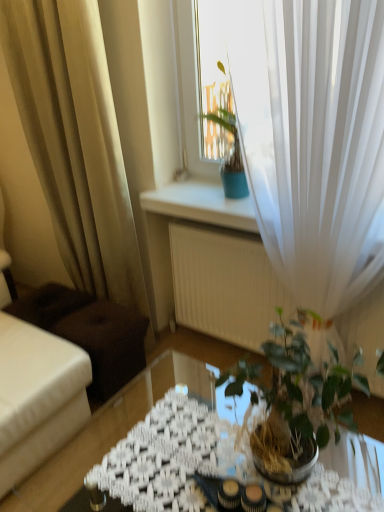
Locate an element on the screen. translucent glass table at center is located at coordinates (131, 444).

This screenshot has width=384, height=512. What do you see at coordinates (317, 156) in the screenshot? I see `white sheer curtain at upper right, the 1th curtain positioned from the right` at bounding box center [317, 156].

Describe the element at coordinates (75, 141) in the screenshot. I see `beige sheer curtain at left, arranged as the first curtain when viewed from the left` at that location.

Find the location of a particular element. Image resolution: width=384 pixels, height=512 pixels. translucent glass table at center is located at coordinates pos(131,444).

Considering the relative sizes of beige sheer curtain at left, arranged as the first curtain when viewed from the left, and green glossy houseplant at center in the image provided, is beige sheer curtain at left, arranged as the first curtain when viewed from the left, shorter than green glossy houseplant at center?

Incorrect, the height of beige sheer curtain at left, arranged as the first curtain when viewed from the left, does not fall short of that of green glossy houseplant at center.

Would you say beige sheer curtain at left, arranged as the first curtain when viewed from the left, is inside or outside green glossy houseplant at center?

beige sheer curtain at left, arranged as the first curtain when viewed from the left, is spatially situated outside green glossy houseplant at center.

Which of these two, beige sheer curtain at left, arranged as the first curtain when viewed from the left, or green glossy houseplant at center, is thinner?

beige sheer curtain at left, arranged as the first curtain when viewed from the left.

Could you tell me if beige sheer curtain at left, arranged as the first curtain when viewed from the left, is turned towards green glossy houseplant at center?

No, beige sheer curtain at left, arranged as the first curtain when viewed from the left, is not aimed at green glossy houseplant at center.

Does white sheer curtain at upper right, which is the 2th curtain from left to right, have a lesser width compared to green glossy houseplant at center?

Indeed, white sheer curtain at upper right, which is the 2th curtain from left to right, has a lesser width compared to green glossy houseplant at center.

Can you tell me how much white sheer curtain at upper right, which is the 2th curtain from left to right, and green glossy houseplant at center differ in facing direction?

white sheer curtain at upper right, which is the 2th curtain from left to right, and green glossy houseplant at center are facing 2.37 degrees away from each other.

Does white sheer curtain at upper right, which is the 2th curtain from left to right, have a larger size compared to green glossy houseplant at center?

Indeed, white sheer curtain at upper right, which is the 2th curtain from left to right, has a larger size compared to green glossy houseplant at center.

Find the location of a particular element. Image resolution: width=384 pixels, height=512 pixels. houseplant on the left of white sheer curtain at upper right, which is the 2th curtain from left to right is located at coordinates (308, 387).

From a real-world perspective, which object stands above the other?

In real-world perspective, beige sheer curtain at left, which is counted as the second curtain, starting from the right, is above.

How different are the orientations of beige sheer curtain at left, which is counted as the second curtain, starting from the right, and translucent glass table at center in degrees?

6.02 degrees separate the facing orientations of beige sheer curtain at left, which is counted as the second curtain, starting from the right, and translucent glass table at center.

Which of these two, beige sheer curtain at left, which is counted as the second curtain, starting from the right, or translucent glass table at center, is thinner?

With smaller width is beige sheer curtain at left, which is counted as the second curtain, starting from the right.

Which point is more forward, (315, 385) or (342, 451)?

The point (315, 385) is closer.

From a real-world perspective, is green glossy houseplant at center positioned above or below translucent glass table at center?

green glossy houseplant at center is situated higher than translucent glass table at center in the real world.

Between white sheer curtain at upper right, the 1th curtain positioned from the right, and translucent glass table at center, which one has more height?

white sheer curtain at upper right, the 1th curtain positioned from the right, is taller.

Is white sheer curtain at upper right, the 1th curtain positioned from the right, next to translucent glass table at center and touching it?

white sheer curtain at upper right, the 1th curtain positioned from the right, and translucent glass table at center are not in contact.

Which is farther from the camera, (261, 81) or (366, 459)?

The point (366, 459) is farther.

From the image's perspective, is white sheer curtain at upper right, the 1th curtain positioned from the right, on translucent glass table at center?

Yes, from the image's perspective, white sheer curtain at upper right, the 1th curtain positioned from the right, is over translucent glass table at center.

Where is `curtain that is in front of the beige sheer curtain at left, arranged as the first curtain when viewed from the left`? curtain that is in front of the beige sheer curtain at left, arranged as the first curtain when viewed from the left is located at coordinates (317, 156).

Considering the sizes of white sheer curtain at upper right, which is the 2th curtain from left to right, and beige sheer curtain at left, arranged as the first curtain when viewed from the left, in the image, is white sheer curtain at upper right, which is the 2th curtain from left to right, taller or shorter than beige sheer curtain at left, arranged as the first curtain when viewed from the left,?

white sheer curtain at upper right, which is the 2th curtain from left to right, is shorter than beige sheer curtain at left, arranged as the first curtain when viewed from the left.

Considering the sizes of white sheer curtain at upper right, the 1th curtain positioned from the right, and beige sheer curtain at left, which is counted as the second curtain, starting from the right, in the image, is white sheer curtain at upper right, the 1th curtain positioned from the right, wider or thinner than beige sheer curtain at left, which is counted as the second curtain, starting from the right,?

Considering their sizes, white sheer curtain at upper right, the 1th curtain positioned from the right, looks broader than beige sheer curtain at left, which is counted as the second curtain, starting from the right.

Does white sheer curtain at upper right, the 1th curtain positioned from the right, appear on the right side of beige sheer curtain at left, which is counted as the second curtain, starting from the right?

Yes, white sheer curtain at upper right, the 1th curtain positioned from the right, is to the right of beige sheer curtain at left, which is counted as the second curtain, starting from the right.

Looking at their sizes, would you say translucent glass table at center is wider or thinner than beige sheer curtain at left, arranged as the first curtain when viewed from the left?

Considering their sizes, translucent glass table at center looks broader than beige sheer curtain at left, arranged as the first curtain when viewed from the left.

Are translucent glass table at center and beige sheer curtain at left, which is counted as the second curtain, starting from the right, far apart?

No, translucent glass table at center is not far from beige sheer curtain at left, which is counted as the second curtain, starting from the right.

Based on the photo, in terms of height, does translucent glass table at center look taller or shorter compared to beige sheer curtain at left, arranged as the first curtain when viewed from the left?

Clearly, translucent glass table at center is shorter compared to beige sheer curtain at left, arranged as the first curtain when viewed from the left.

From the image's perspective, is translucent glass table at center under beige sheer curtain at left, which is counted as the second curtain, starting from the right?

Correct, translucent glass table at center appears lower than beige sheer curtain at left, which is counted as the second curtain, starting from the right, in the image.

From a real-world perspective, which curtain is the 1st one above the green glossy houseplant at center? Please provide its 2D coordinates.

[(75, 141)]

At what (x,y) coordinates should I click in order to perform the action: click on houseplant in front of the white sheer curtain at upper right, the 1th curtain positioned from the right. Please return your answer as a coordinate pair (x, y). Looking at the image, I should click on (308, 387).

Based on their spatial positions, is beige sheer curtain at left, which is counted as the second curtain, starting from the right, or translucent glass table at center further from green glossy houseplant at center?

beige sheer curtain at left, which is counted as the second curtain, starting from the right, lies further to green glossy houseplant at center than the other object.

Estimate the real-world distances between objects in this image. Which object is closer to beige sheer curtain at left, arranged as the first curtain when viewed from the left, green glossy houseplant at center or white sheer curtain at upper right, which is the 2th curtain from left to right?

white sheer curtain at upper right, which is the 2th curtain from left to right, is positioned closer to the anchor beige sheer curtain at left, arranged as the first curtain when viewed from the left.

When comparing their distances from beige sheer curtain at left, which is counted as the second curtain, starting from the right, does white sheer curtain at upper right, which is the 2th curtain from left to right, or translucent glass table at center seem closer?

white sheer curtain at upper right, which is the 2th curtain from left to right, is closer to beige sheer curtain at left, which is counted as the second curtain, starting from the right.

When comparing their distances from translucent glass table at center, does white sheer curtain at upper right, which is the 2th curtain from left to right, or beige sheer curtain at left, which is counted as the second curtain, starting from the right, seem closer?

beige sheer curtain at left, which is counted as the second curtain, starting from the right, is closer to translucent glass table at center.

Estimate the real-world distances between objects in this image. Which object is closer to beige sheer curtain at left, arranged as the first curtain when viewed from the left, white sheer curtain at upper right, the 1th curtain positioned from the right, or green glossy houseplant at center?

Based on the image, white sheer curtain at upper right, the 1th curtain positioned from the right, appears to be nearer to beige sheer curtain at left, arranged as the first curtain when viewed from the left.

Which object lies further to the anchor point translucent glass table at center, green glossy houseplant at center or beige sheer curtain at left, which is counted as the second curtain, starting from the right?

beige sheer curtain at left, which is counted as the second curtain, starting from the right, lies further to translucent glass table at center than the other object.

Looking at this image, based on their spatial positions, is green glossy houseplant at center or beige sheer curtain at left, arranged as the first curtain when viewed from the left, further from white sheer curtain at upper right, the 1th curtain positioned from the right?

Among the two, beige sheer curtain at left, arranged as the first curtain when viewed from the left, is located further to white sheer curtain at upper right, the 1th curtain positioned from the right.

When comparing their distances from translucent glass table at center, does green glossy houseplant at center or white sheer curtain at upper right, the 1th curtain positioned from the right, seem closer?

green glossy houseplant at center is closer to translucent glass table at center.

What are the coordinates of `houseplant between beige sheer curtain at left, which is counted as the second curtain, starting from the right, and white sheer curtain at upper right, the 1th curtain positioned from the right, in the horizontal direction` in the screenshot? It's located at (308, 387).

The image size is (384, 512). What are the coordinates of `houseplant between white sheer curtain at upper right, which is the 2th curtain from left to right, and translucent glass table at center from top to bottom` in the screenshot? It's located at (308, 387).

Identify the location of houseplant between beige sheer curtain at left, arranged as the first curtain when viewed from the left, and translucent glass table at center in the up-down direction. (308, 387).

Where is `curtain between beige sheer curtain at left, which is counted as the second curtain, starting from the right, and translucent glass table at center vertically`? Image resolution: width=384 pixels, height=512 pixels. curtain between beige sheer curtain at left, which is counted as the second curtain, starting from the right, and translucent glass table at center vertically is located at coordinates (317, 156).